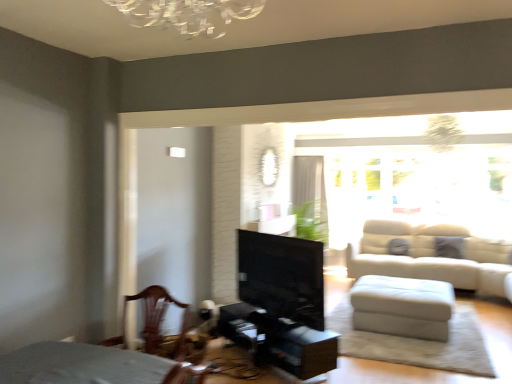
What is the approximate width of white leather ottoman at lower right?

3.46 feet.

Measure the distance between point (157, 293) and camera.

The depth of point (157, 293) is 2.48 meters.

Describe the element at coordinates (155, 324) in the screenshot. I see `wooden chair at lower left` at that location.

Describe the element at coordinates (282, 276) in the screenshot. I see `black glossy fireplace at center` at that location.

Locate an element on the screen. This screenshot has height=384, width=512. transparent glass window at upper right is located at coordinates (414, 184).

Is white sheer curtain at upper center completely or partially outside of white leather ottoman at lower right?

That's correct, white sheer curtain at upper center is outside of white leather ottoman at lower right.

Can you confirm if white sheer curtain at upper center is shorter than white leather ottoman at lower right?

Incorrect, the height of white sheer curtain at upper center does not fall short of that of white leather ottoman at lower right.

Does white sheer curtain at upper center have a larger size compared to white leather ottoman at lower right?

No, white sheer curtain at upper center is not bigger than white leather ottoman at lower right.

Which object is positioned more to the left, white sheer curtain at upper center or white leather ottoman at lower right?

white sheer curtain at upper center is more to the left.

From a real-world perspective, is white leather ottoman at lower right located beneath white sheer curtain at upper center?

Correct, in the physical world, white leather ottoman at lower right is lower than white sheer curtain at upper center.

Considering the relative positions of white leather ottoman at lower right and white sheer curtain at upper center in the image provided, is white leather ottoman at lower right in front of white sheer curtain at upper center?

Yes, white leather ottoman at lower right is closer to the camera.

Where is `curtain that is on the left side of white leather ottoman at lower right`? This screenshot has height=384, width=512. curtain that is on the left side of white leather ottoman at lower right is located at coordinates (310, 198).

Based on the photo, considering the sizes of objects white leather ottoman at lower right and white sheer curtain at upper center in the image provided, who is thinner, white leather ottoman at lower right or white sheer curtain at upper center?

white sheer curtain at upper center.

Between black glossy fireplace at center and white leather ottoman at lower right, which one appears on the right side from the viewer's perspective?

From the viewer's perspective, white leather ottoman at lower right appears more on the right side.

In the scene shown: Is black glossy fireplace at center turned away from white leather ottoman at lower right?

No, black glossy fireplace at center is not facing the opposite direction of white leather ottoman at lower right.

Which of these two, black glossy fireplace at center or white leather ottoman at lower right, stands shorter?

With less height is white leather ottoman at lower right.

Considering the sizes of objects black glossy fireplace at center and white leather ottoman at lower right in the image provided, who is bigger, black glossy fireplace at center or white leather ottoman at lower right?

white leather ottoman at lower right is bigger.

In the scene shown: Is wooden chair at lower left inside or outside of white sheer curtain at upper center?

wooden chair at lower left is spatially situated outside white sheer curtain at upper center.

From the image's perspective, is wooden chair at lower left located above or below white sheer curtain at upper center?

From the image's perspective, wooden chair at lower left appears below white sheer curtain at upper center.

Looking at this image, how different are the orientations of wooden chair at lower left and white sheer curtain at upper center in degrees?

They differ by 0.213 degrees in their facing directions.

Is wooden chair at lower left aimed at white sheer curtain at upper center?

No.

Is white sheer curtain at upper center a part of transparent glass window at upper right?

No, white sheer curtain at upper center is not surrounded by transparent glass window at upper right.

Who is bigger, transparent glass window at upper right or white sheer curtain at upper center?

With larger size is transparent glass window at upper right.

From a real-world perspective, which object rests below the other?

white sheer curtain at upper center is physically lower.

From the image's perspective, which object appears higher, transparent glass window at upper right or white sheer curtain at upper center?

transparent glass window at upper right appears higher in the image.

Considering the relative sizes of transparent glass window at upper right and wooden chair at lower left in the image provided, is transparent glass window at upper right thinner than wooden chair at lower left?

Yes.

Is transparent glass window at upper right with wooden chair at lower left?

No, transparent glass window at upper right is not making contact with wooden chair at lower left.

Could you tell me if transparent glass window at upper right is turned towards wooden chair at lower left?

Yes.

Between transparent glass window at upper right and wooden chair at lower left, which one has more height?

Standing taller between the two is transparent glass window at upper right.

Which of these two, transparent glass window at upper right or white leather ottoman at lower right, is smaller?

Smaller between the two is white leather ottoman at lower right.

From a real-world perspective, is transparent glass window at upper right above or below white leather ottoman at lower right?

transparent glass window at upper right is above white leather ottoman at lower right.

Is transparent glass window at upper right positioned far away from white leather ottoman at lower right?

Yes, transparent glass window at upper right and white leather ottoman at lower right are quite far apart.

Considering the relative sizes of transparent glass window at upper right and white leather ottoman at lower right in the image provided, is transparent glass window at upper right shorter than white leather ottoman at lower right?

No, transparent glass window at upper right is not shorter than white leather ottoman at lower right.

You are a GUI agent. You are given a task and a screenshot of the screen. Output one action in this format:
    pyautogui.click(x=<x>, y=<y>)
    Task: Click on the table located in front of the white sheer curtain at upper center
    Image resolution: width=512 pixels, height=384 pixels.
    Given the screenshot: What is the action you would take?
    pyautogui.click(x=402, y=306)

Where is `curtain that appears above the white leather ottoman at lower right (from a real-world perspective)`? This screenshot has width=512, height=384. curtain that appears above the white leather ottoman at lower right (from a real-world perspective) is located at coordinates (310, 198).

Based on their spatial positions, is white sheer curtain at upper center or wooden chair at lower left further from white leather ottoman at lower right?

wooden chair at lower left lies further to white leather ottoman at lower right than the other object.

Which object lies nearer to the anchor point wooden chair at lower left, white leather ottoman at lower right or transparent glass window at upper right?

white leather ottoman at lower right.

Based on their spatial positions, is white sheer curtain at upper center or white leather ottoman at lower right closer to transparent glass window at upper right?

The object closer to transparent glass window at upper right is white sheer curtain at upper center.

Based on their spatial positions, is black glossy fireplace at center or wooden chair at lower left further from white sheer curtain at upper center?

Among the two, wooden chair at lower left is located further to white sheer curtain at upper center.

Looking at the image, which one is located closer to transparent glass window at upper right, white sheer curtain at upper center or wooden chair at lower left?

The object closer to transparent glass window at upper right is white sheer curtain at upper center.

Considering their positions, is white leather ottoman at lower right positioned closer to transparent glass window at upper right than black glossy fireplace at center?

white leather ottoman at lower right lies closer to transparent glass window at upper right than the other object.

From the image, which object appears to be nearer to white sheer curtain at upper center, transparent glass window at upper right or wooden chair at lower left?

transparent glass window at upper right is positioned closer to the anchor white sheer curtain at upper center.

Estimate the real-world distances between objects in this image. Which object is further from black glossy fireplace at center, white sheer curtain at upper center or wooden chair at lower left?

white sheer curtain at upper center is further to black glossy fireplace at center.

I want to click on window screen between white leather ottoman at lower right and white sheer curtain at upper center from front to back, so click(414, 184).

Locate an element on the screen. The width and height of the screenshot is (512, 384). fireplace between wooden chair at lower left and white leather ottoman at lower right in the horizontal direction is located at coordinates (282, 276).

The width and height of the screenshot is (512, 384). I want to click on window screen located between black glossy fireplace at center and white sheer curtain at upper center in the depth direction, so click(414, 184).

Identify the location of fireplace positioned between wooden chair at lower left and transparent glass window at upper right from near to far. This screenshot has height=384, width=512. (282, 276).